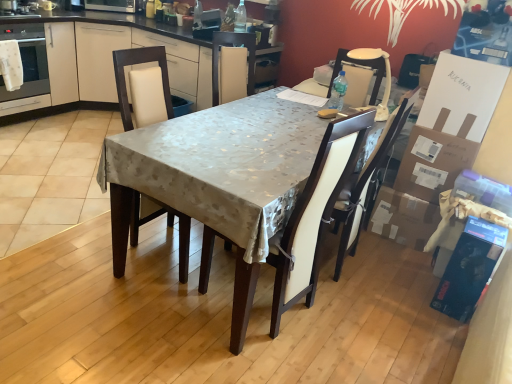
The width and height of the screenshot is (512, 384). In order to click on vacant space situated on the left part of matte white chair at center, placed as the third chair when sorted from right to left in this screenshot , I will do `click(82, 243)`.